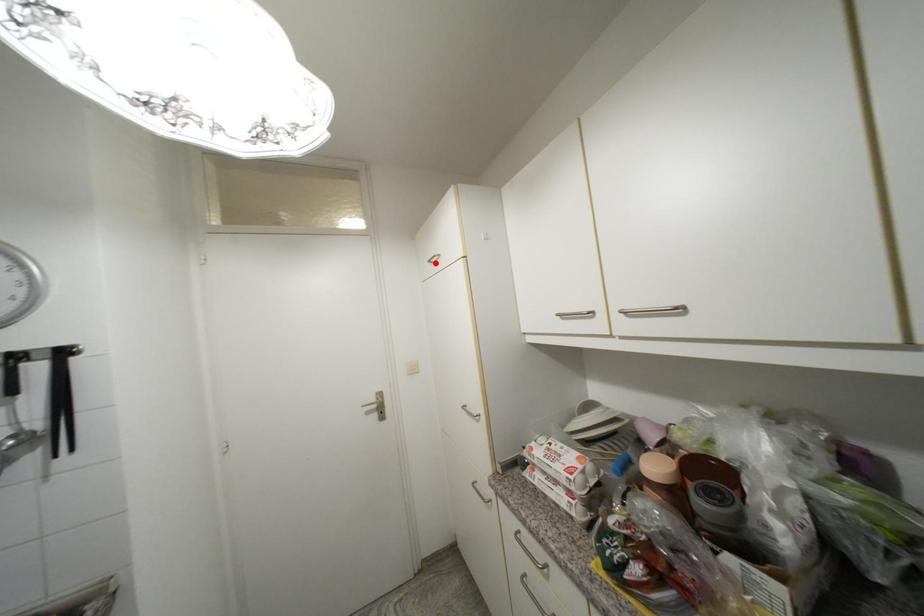
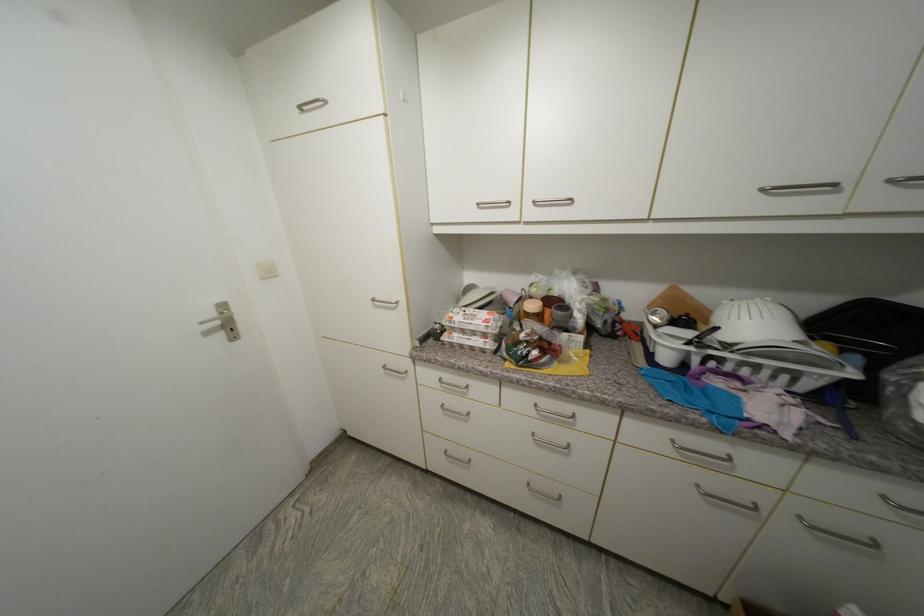
Question: I am providing you with two images of the same scene from different viewpoints. Given a red point in image1, look at the same physical point in image2. Is it:

Choices:
 (A) Closer to the viewpoint
 (B) Farther from the viewpoint

Answer: (B)